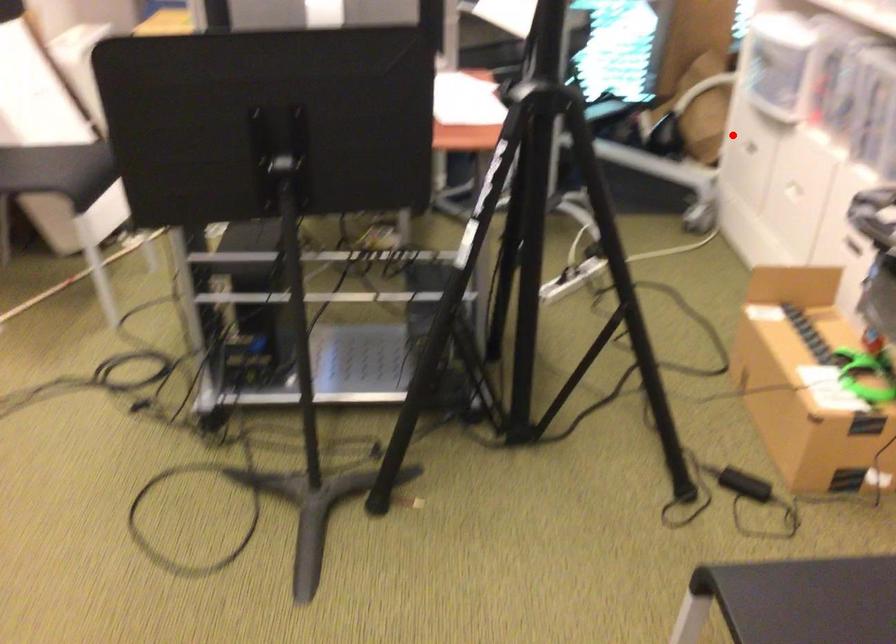
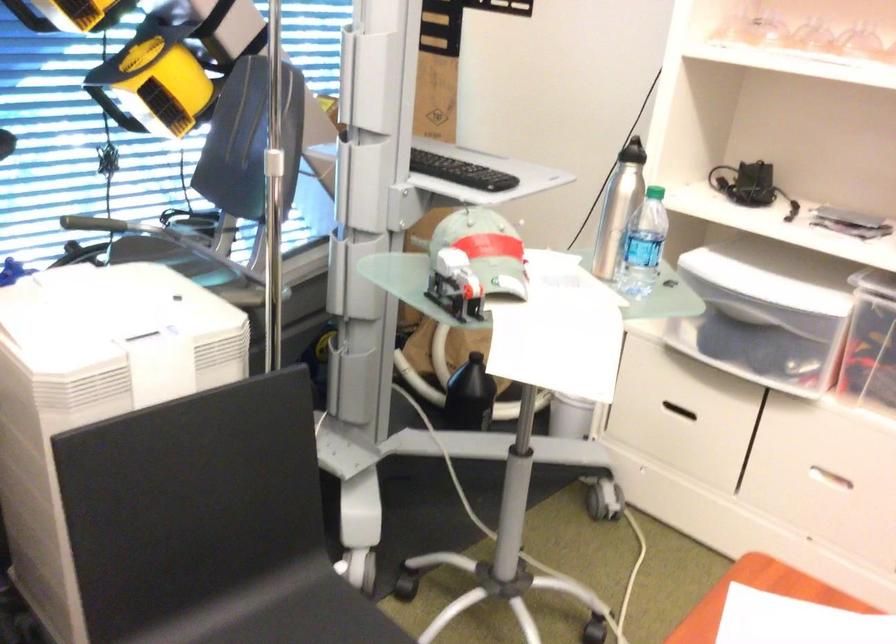
Locate, in the second image, the point that corresponds to the highlighted location in the first image.

(677, 411)